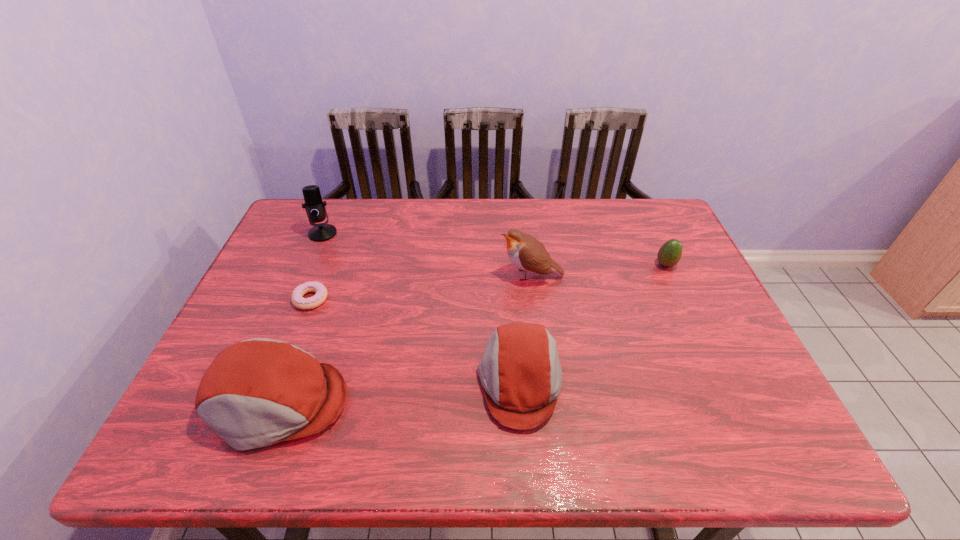
Locate an element on the screen. unoccupied area between the right cap and the avocado is located at coordinates (592, 323).

Locate an element on the screen. Image resolution: width=960 pixels, height=540 pixels. vacant area that lies between the shortest object and the fifth tallest object is located at coordinates (489, 282).

Identify the location of vacant space that is in between the bird and the left cap. The height and width of the screenshot is (540, 960). (405, 339).

Image resolution: width=960 pixels, height=540 pixels. Identify the location of free point between the bird and the second shortest object. (598, 270).

Locate an element on the screen. free space between the third shortest object and the microphone is located at coordinates (421, 308).

Locate an element on the screen. The width and height of the screenshot is (960, 540). free spot between the avocado and the microphone is located at coordinates (494, 249).

Where is `blank region between the microphone and the avocado`? The height and width of the screenshot is (540, 960). blank region between the microphone and the avocado is located at coordinates (494, 249).

Image resolution: width=960 pixels, height=540 pixels. I want to click on the third closest object relative to the microphone, so click(527, 253).

Locate which object ranks fifth in proximity to the fifth tallest object. Please provide its 2D coordinates. Your answer should be formatted as a tuple, i.e. [(x, y)], where the tuple contains the x and y coordinates of a point satisfying the conditions above.

[(315, 208)]

What are the coordinates of `vacant space that satisfies the following two spatial constraints: 1. on the stand of the microphone; 2. on the left side of the doughnut` in the screenshot? It's located at (295, 299).